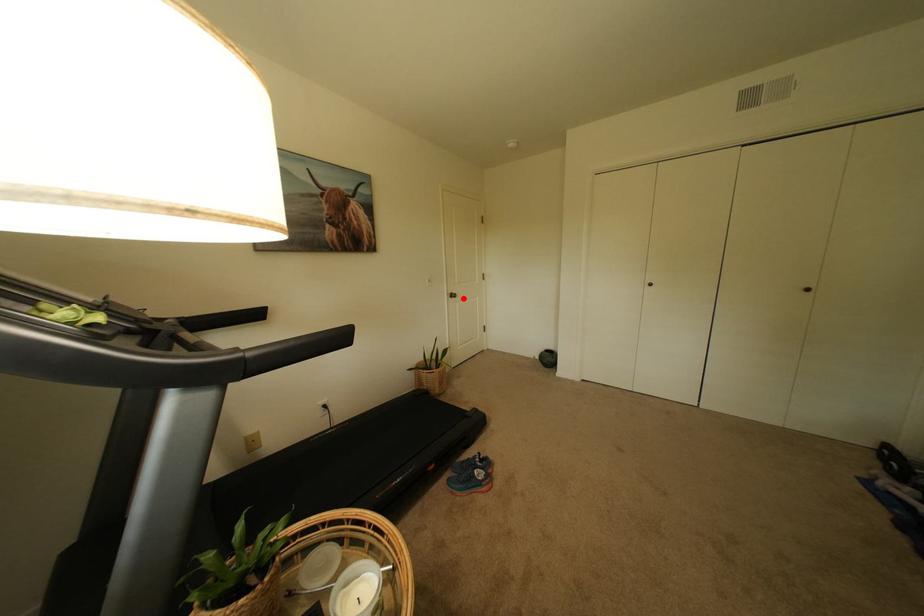
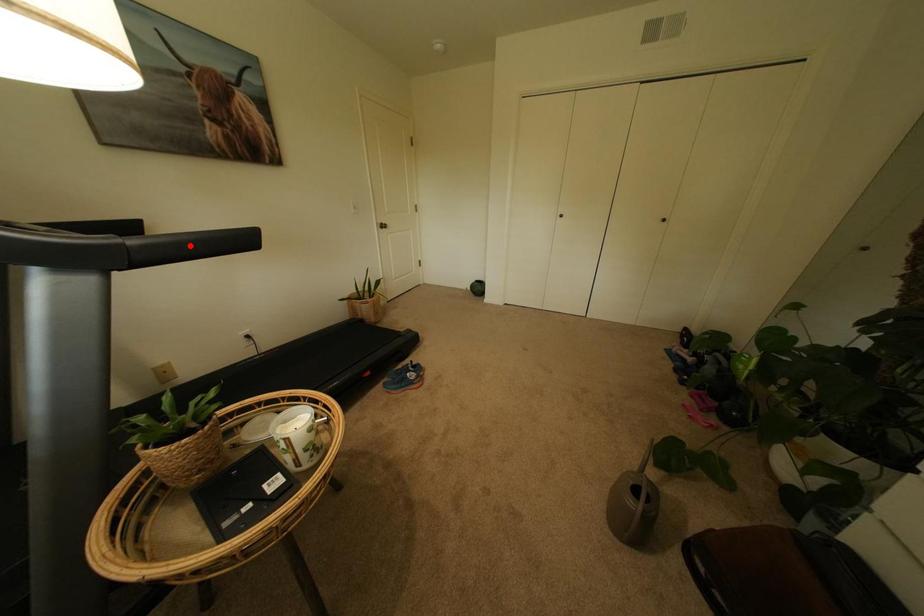
I am providing you with two images of the same scene from different viewpoints. A red point is marked on the first image and another point is marked on the second image. Is the red point in image1 aligned with the point shown in image2?

No